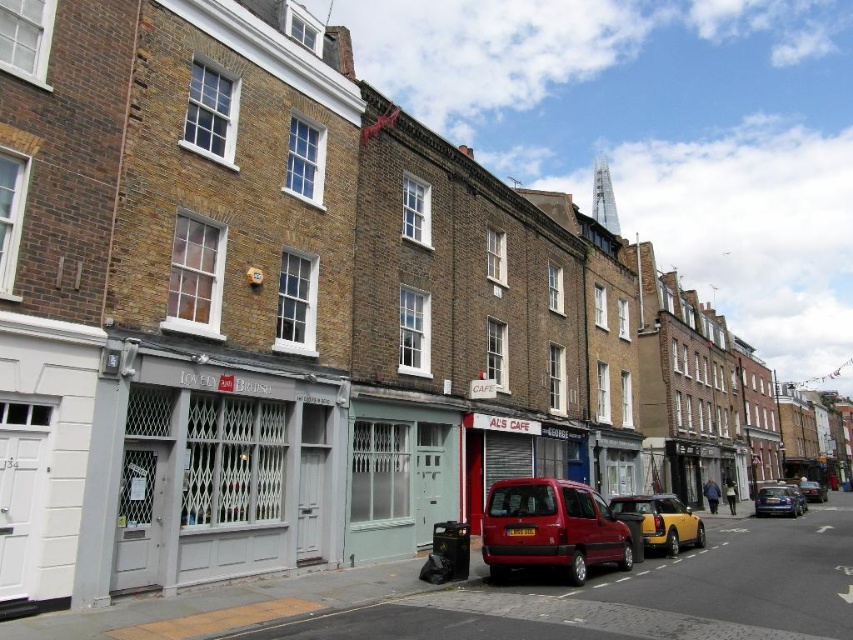
Question: Among these objects, which one is farthest from the camera?

Choices:
 (A) matte red van at center
 (B) metallic silver car at center

Answer: (B)

Question: Does matte gray storefront at center appear over metallic silver car at center?

Choices:
 (A) no
 (B) yes

Answer: (B)

Question: Considering the relative positions of matte gray storefront at center and matte red van at center in the image provided, where is matte gray storefront at center located with respect to matte red van at center?

Choices:
 (A) left
 (B) right

Answer: (A)

Question: Does metallic silver car at center appear on the left side of yellow metallic car at center?

Choices:
 (A) yes
 (B) no

Answer: (B)

Question: Which object is closer to the camera taking this photo?

Choices:
 (A) matte red van at center
 (B) metallic blue car at center-right

Answer: (A)

Question: Which of the following is the farthest from the observer?

Choices:
 (A) (759, 493)
 (B) (618, 552)
 (C) (798, 497)
 (D) (808, 499)

Answer: (D)